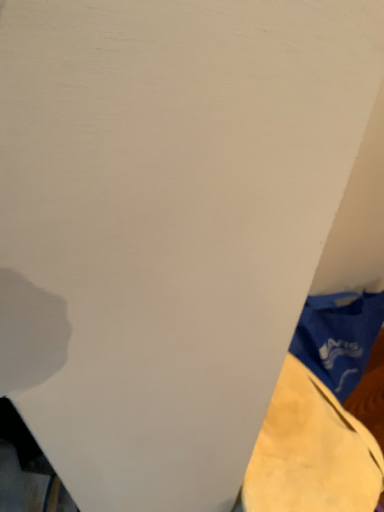
What do you see at coordinates (317, 410) in the screenshot?
I see `yellow fabric at lower right` at bounding box center [317, 410].

The image size is (384, 512). In order to click on yellow fabric at lower right in this screenshot , I will do `click(317, 410)`.

Identify the location of yellow fabric at lower right. (317, 410).